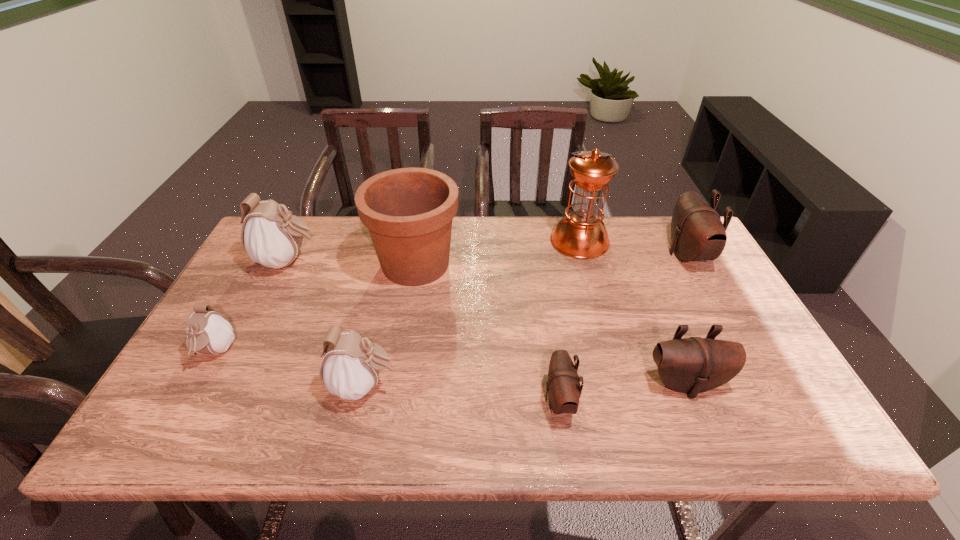
You are a GUI agent. You are given a task and a screenshot of the screen. Output one action in this format:
    pyautogui.click(x=<x>, y=<y>)
    Task: Click on the smallest brown pouch
    This screenshot has width=960, height=540.
    Given the screenshot: What is the action you would take?
    pyautogui.click(x=563, y=387)

The height and width of the screenshot is (540, 960). I want to click on the third pouch from right to left, so click(x=563, y=387).

The width and height of the screenshot is (960, 540). I want to click on vacant space situated on the front of the oil lamp, so click(x=606, y=338).

Where is `free space located 0.350m on the right of the flowerpot`? free space located 0.350m on the right of the flowerpot is located at coordinates (576, 264).

Locate an element on the screen. free space located 0.200m on the front-facing side of the farthest white pouch is located at coordinates (387, 261).

Image resolution: width=960 pixels, height=540 pixels. Identify the location of vacant space located with the flap open on the rightmost object. (636, 254).

Locate an element on the screen. This screenshot has height=540, width=960. blank space located 0.280m with the flap open on the rightmost object is located at coordinates [578, 254].

Locate an element on the screen. The height and width of the screenshot is (540, 960). vacant space situated 0.370m with the flap open on the rightmost object is located at coordinates (549, 254).

I want to click on vacant space located 0.350m on the front-facing side of the second biggest white pouch, so click(551, 386).

This screenshot has height=540, width=960. I want to click on vacant point located with the flap open on the second pouch from right to left, so click(708, 438).